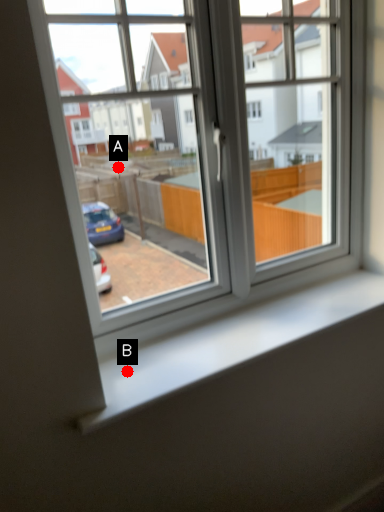
Question: Two points are circled on the image, labeled by A and B beside each circle. Which of the following is the closest to the observer?

Choices:
 (A) A is closer
 (B) B is closer

Answer: (B)